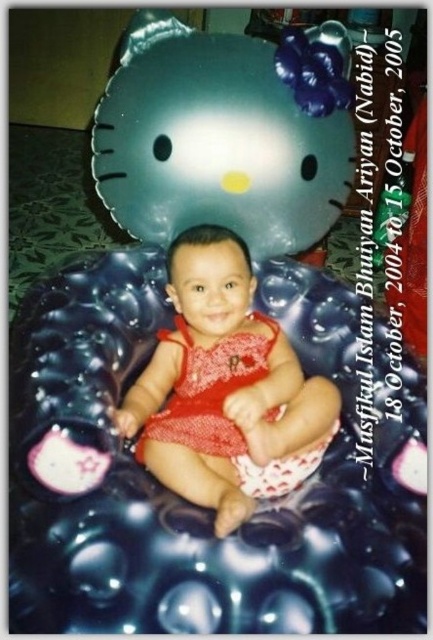
Based on the photo, you are a photographer trying to capture the perfect shot of the baby in the Hello Kitty float. You notice the matte blue balloon at upper center in the background. To avoid it appearing in your photo, where should you position yourself relative to the current camera angle?

Since the matte blue balloon at upper center is located at coordinates point (x=226, y=132), you should position yourself slightly to the right or left of the current angle to avoid the balloon appearing in the frame.

You are a photographer setting up a shoot for a baby product catalog. You have a matte blue balloon at upper center and a red knitted dress at center in the scene. Which object should you focus on first if you want to highlight the smaller item in the catalog?

The matte blue balloon at upper center should be focused on first because it is smaller than the red knitted dress at center, making it the smaller item to highlight.